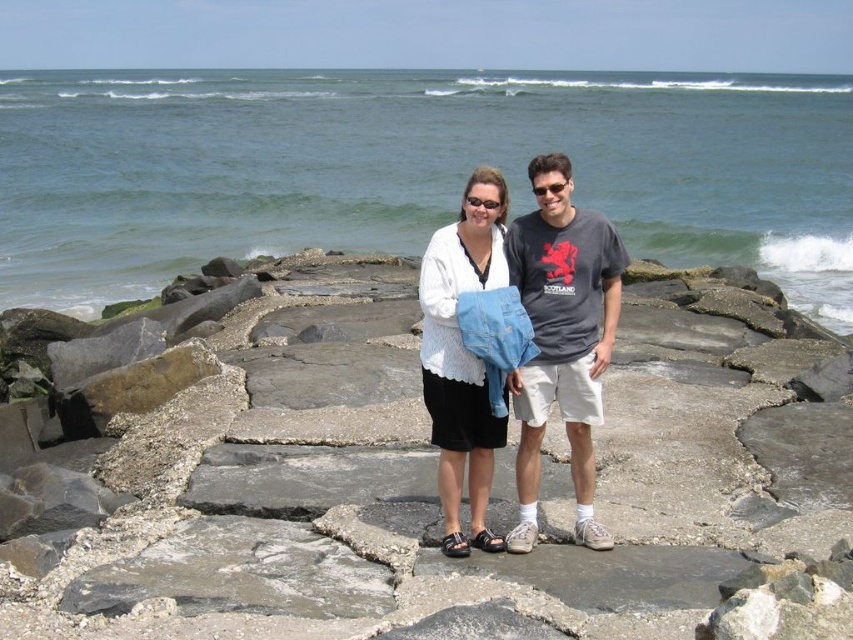
You are standing at the origin point of the coordinate system. You want to move to the gray concrete at center. What are the coordinates you need to move to?

The coordinates to move to are 0.756 in the x direction and 0.510 in the y direction.